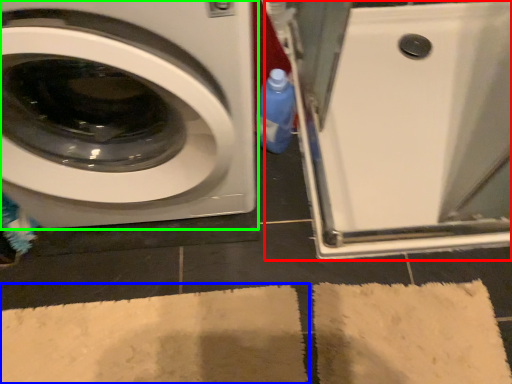
Question: Which is nearer to the machine (highlighted by a red box)? bath mat (highlighted by a blue box) or washing machine (highlighted by a green box).

Choices:
 (A) bath mat
 (B) washing machine

Answer: (B)